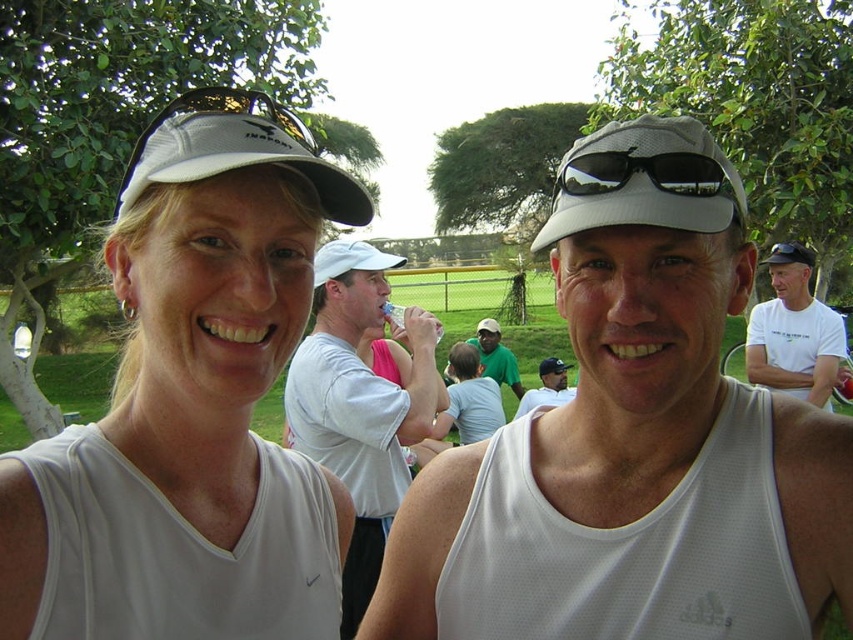
Does white mesh cap at upper center have a greater width compared to green mesh shirt at center?

No.

Who is taller, white mesh cap at upper center or green mesh shirt at center?

green mesh shirt at center

At what (x,y) coordinates should I click in order to perform the action: click on white mesh cap at upper center. Please return your answer as a coordinate pair (x, y). The width and height of the screenshot is (853, 640). Looking at the image, I should click on (225, 115).

Locate an element on the screen. white mesh cap at upper center is located at coordinates pyautogui.click(x=225, y=115).

Consider the image. Does black reflective sunglasses at center have a lesser height compared to matte white tank top at center?

Correct, black reflective sunglasses at center is not as tall as matte white tank top at center.

Can you confirm if black reflective sunglasses at center is positioned to the left of matte white tank top at center?

Indeed, black reflective sunglasses at center is positioned on the left side of matte white tank top at center.

Who is more forward, (576, 164) or (535, 404)?

Point (576, 164)

Where is `black reflective sunglasses at center`? This screenshot has height=640, width=853. black reflective sunglasses at center is located at coordinates (643, 172).

Does white mesh tank top at center have a lesser height compared to matte white tank top at center?

Incorrect, white mesh tank top at center's height does not fall short of matte white tank top at center's.

Who is more forward, (614, 228) or (560, 368)?

Point (614, 228) is in front.

At what (x,y) coordinates should I click in order to perform the action: click on white mesh tank top at center. Please return your answer as a coordinate pair (x, y). Looking at the image, I should click on (633, 451).